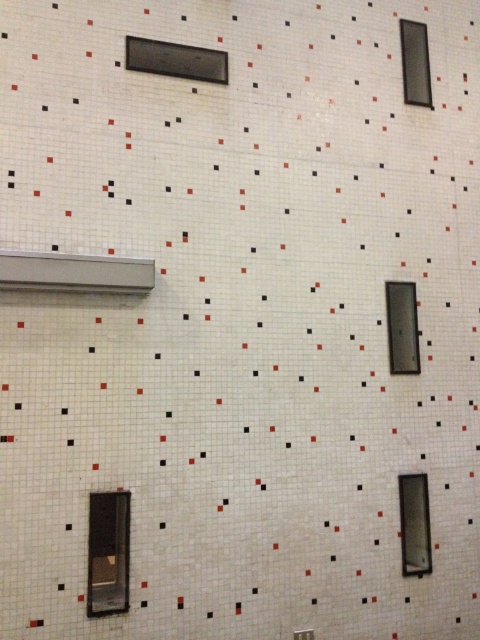
Question: Does matte black window at upper center have a lesser width compared to clear glass window at lower right?

Choices:
 (A) no
 (B) yes

Answer: (A)

Question: Among these points, which one is farthest from the camera?

Choices:
 (A) (422, 97)
 (B) (404, 566)

Answer: (A)

Question: Is matte black window at upper center in front of clear glass window at lower right?

Choices:
 (A) yes
 (B) no

Answer: (A)

Question: Is matte glass window at lower center bigger than clear glass window at lower right?

Choices:
 (A) no
 (B) yes

Answer: (B)

Question: Estimate the real-world distances between objects in this image. Which object is closer to the matte glass window at lower center?

Choices:
 (A) transparent glass window at center
 (B) matte black window at upper center
 (C) clear glass window at lower right

Answer: (C)

Question: Among these points, which one is nearest to the camera?

Choices:
 (A) (143, 67)
 (B) (103, 552)
 (C) (414, 84)

Answer: (B)